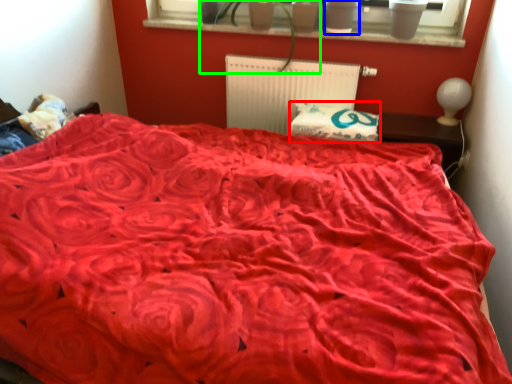
Question: Estimate the real-world distances between objects in this image. Which object is farther from pillow (highlighted by a red box), flowerpot (highlighted by a blue box) or houseplant (highlighted by a green box)?

Choices:
 (A) flowerpot
 (B) houseplant

Answer: (A)